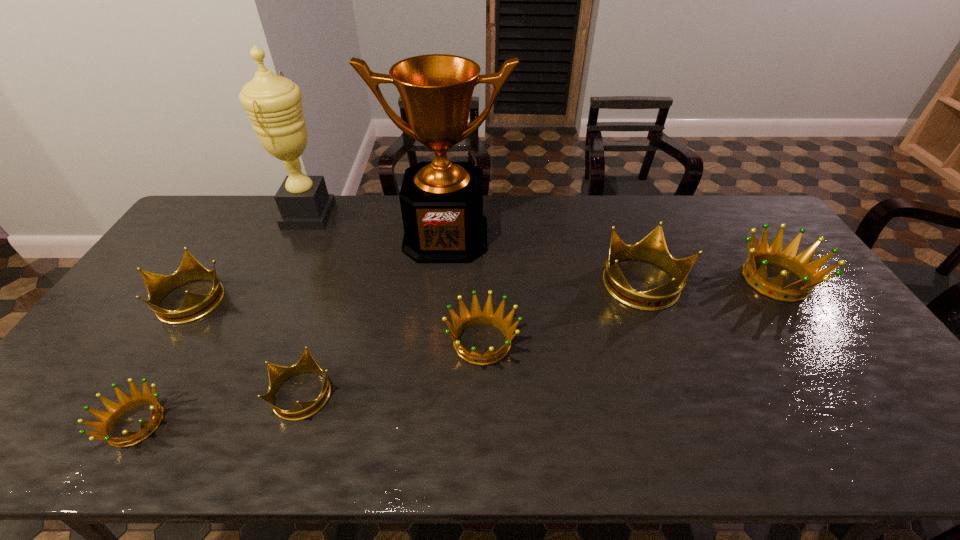
Image resolution: width=960 pixels, height=540 pixels. Find the location of `vacant space located on the left of the second gold crown from right to left`. vacant space located on the left of the second gold crown from right to left is located at coordinates (210, 393).

I want to click on free space located 0.120m on the left of the nearest golden crown, so click(51, 424).

This screenshot has width=960, height=540. Find the location of `object that is at the right edge`. object that is at the right edge is located at coordinates (809, 273).

You are a GUI agent. You are given a task and a screenshot of the screen. Output one action in this format:
    pyautogui.click(x=<x>, y=<y>)
    Task: Click on the object positioned at the near left corner
    
    Given the screenshot: What is the action you would take?
    pyautogui.click(x=126, y=403)

In the image, there is a desktop. In order to click on free space at the far edge in this screenshot , I will do `click(647, 220)`.

In the image, there is a desktop. Identify the location of vacant space at the near edge. (561, 440).

In the image, there is a desktop. Identify the location of vacant space at the left edge. This screenshot has height=540, width=960. (133, 327).

Locate an element on the screen. This screenshot has width=960, height=540. free space at the far left corner of the desktop is located at coordinates (203, 208).

Identify the location of vacant space at the near left corner. The height and width of the screenshot is (540, 960). (63, 451).

Find the location of a particular element. Image resolution: width=960 pixels, height=540 pixels. free spot between the rightmost golden crown and the second object from right to left is located at coordinates (709, 282).